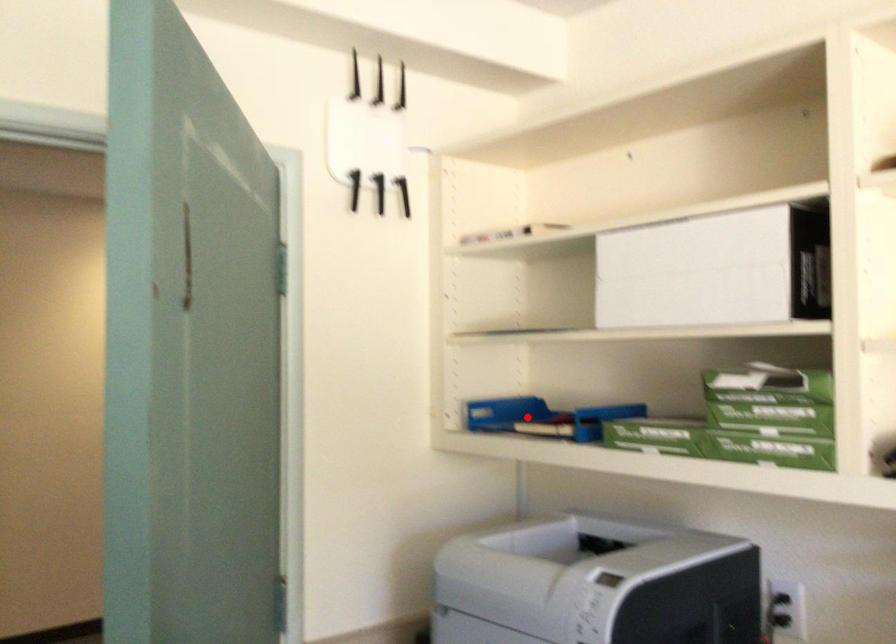
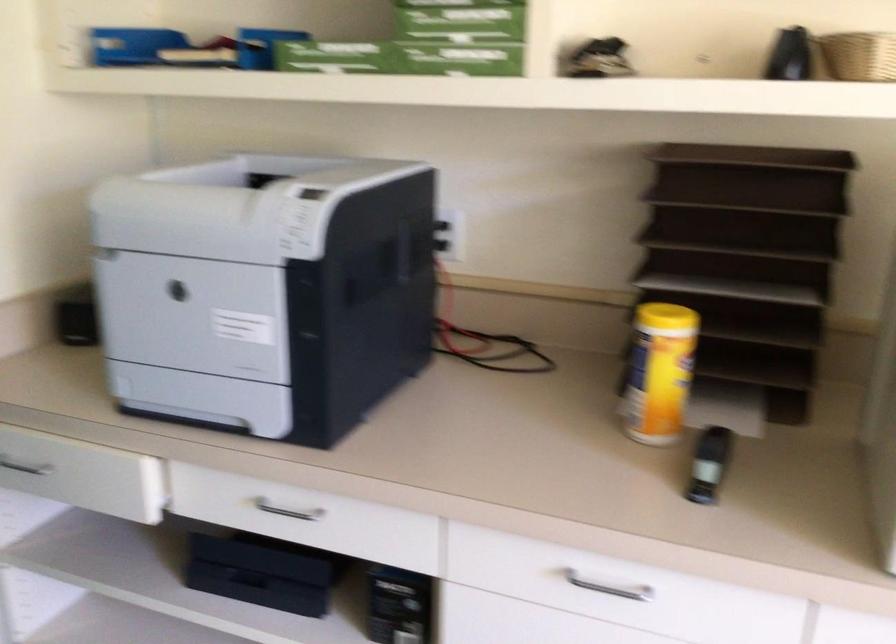
The point at the highlighted location is marked in the first image. Where is the corresponding point in the second image?

(165, 49)